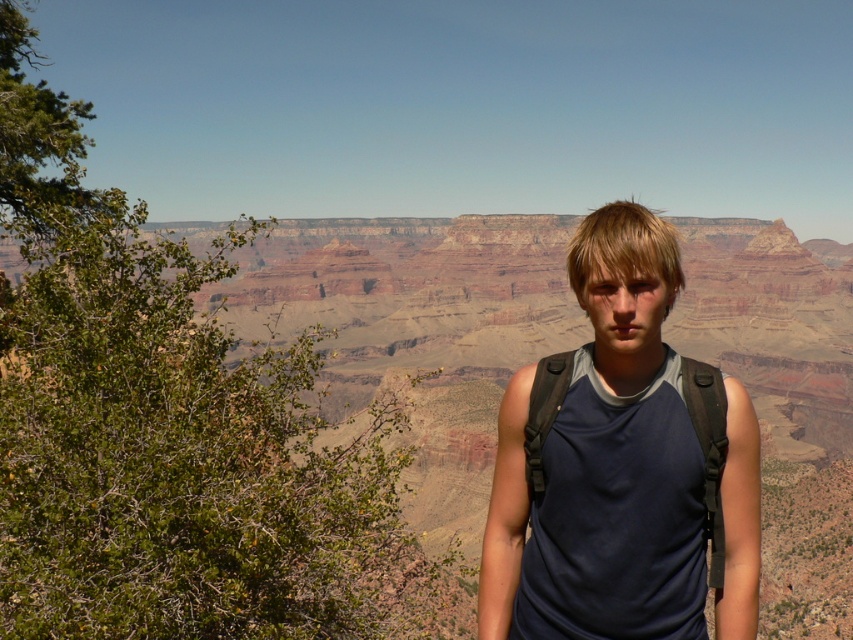
Question: Which point is farther to the camera?

Choices:
 (A) brown rock canyon at center
 (B) dark blue fabric tank top at center

Answer: (A)

Question: Is brown rock canyon at center to the right of dark blue fabric tank top at center from the viewer's perspective?

Choices:
 (A) no
 (B) yes

Answer: (A)

Question: Does brown rock canyon at center lie behind dark blue fabric tank top at center?

Choices:
 (A) no
 (B) yes

Answer: (B)

Question: Which point is farther to the camera?

Choices:
 (A) (196, 273)
 (B) (654, 314)

Answer: (A)

Question: Which point is closer to the camera?

Choices:
 (A) dark blue fabric tank top at center
 (B) brown rock canyon at center

Answer: (A)

Question: From the image, what is the correct spatial relationship of brown rock canyon at center in relation to dark blue fabric tank top at center?

Choices:
 (A) below
 (B) above

Answer: (B)